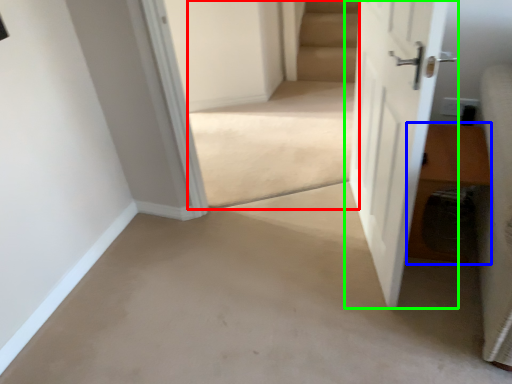
Question: Which object is the farthest from stairwell (highlighted by a red box)? Choose among these: hardwood (highlighted by a blue box) or door (highlighted by a green box).

Choices:
 (A) hardwood
 (B) door

Answer: (A)